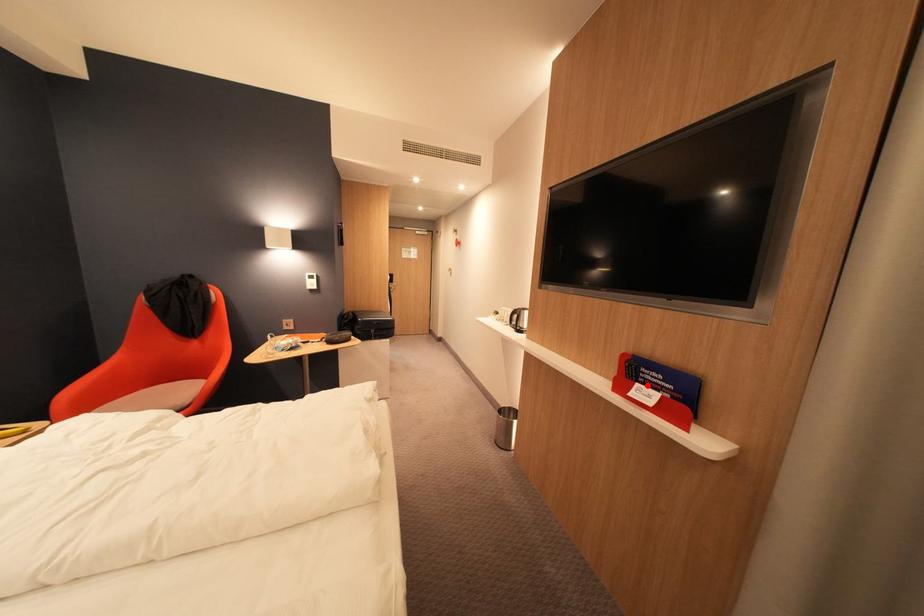
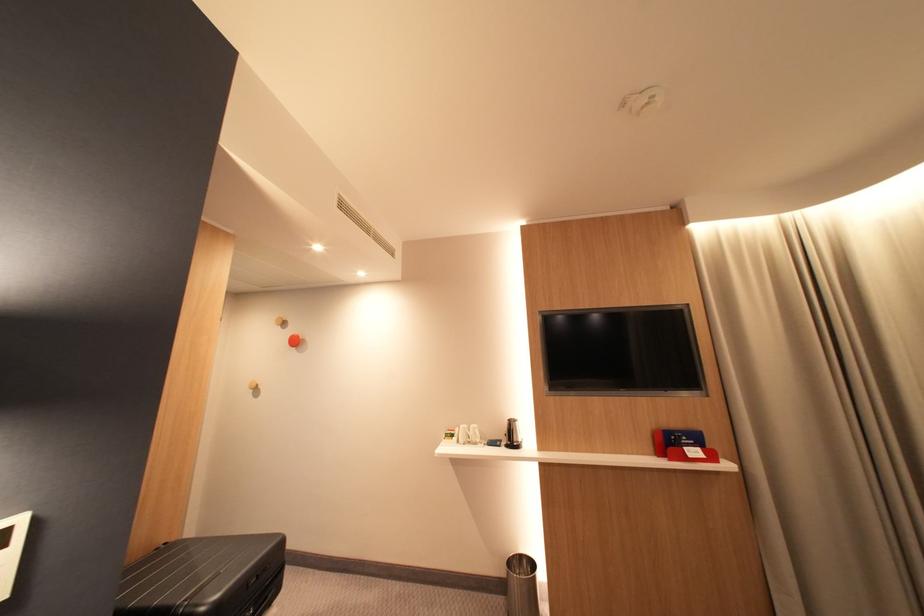
Find the pixel in the second image that matches the highlighted location in the first image.

(696, 450)